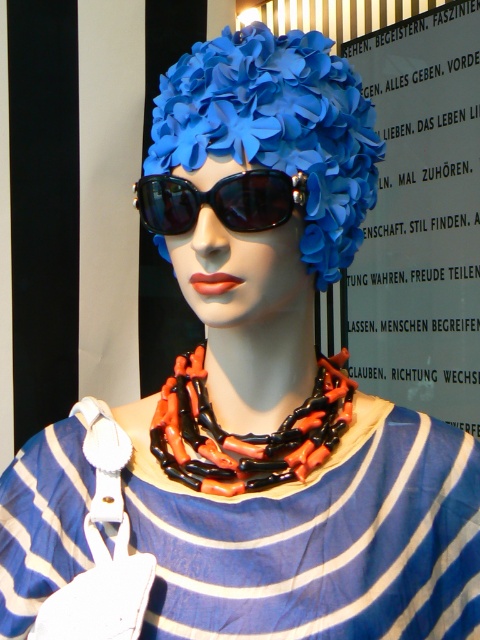
Between point (304, 561) and point (216, 433), which one is positioned behind?

The point (216, 433) is more distant.

Who is more forward, (271, 557) or (168, 452)?

Point (271, 557) is in front.

Find the location of a particular element. blue striped fabric dress at center is located at coordinates (323, 541).

Between matte plastic flowers at center and black glossy sunglasses at center, which one has more height?

matte plastic flowers at center

Between point (257, 92) and point (175, 221), which one is positioned behind?

The point (175, 221) is more distant.

Who is more forward, (342, 212) or (249, 220)?

Point (249, 220) is more forward.

I want to click on matte plastic flowers at center, so point(276,128).

Between matte plastic flowers at center and orange-black beaded necklace at center, which one has less height?

orange-black beaded necklace at center is shorter.

Between matte plastic flowers at center and orange-black beaded necklace at center, which one is positioned higher?

Positioned higher is matte plastic flowers at center.

Between point (337, 115) and point (276, 436), which one is positioned in front?

Positioned in front is point (337, 115).

Where is `matte plastic flowers at center`? matte plastic flowers at center is located at coordinates (276, 128).